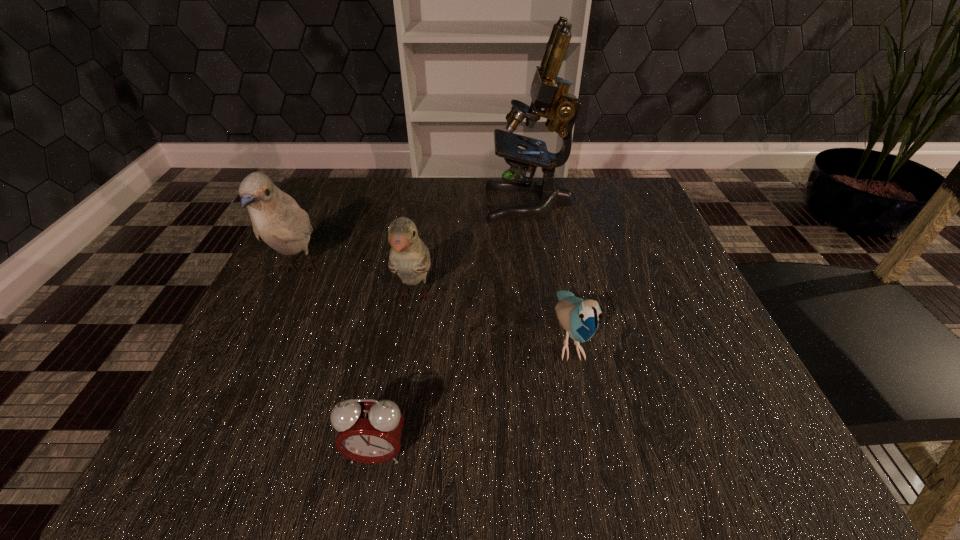
Locate an element on the screen. The image size is (960, 540). vacant space that's between the shortest object and the third tallest object is located at coordinates (396, 376).

Identify the location of free space between the tallest bird and the nearest object. Image resolution: width=960 pixels, height=540 pixels. (338, 361).

Where is `free space between the microscope and the rightmost bird`? free space between the microscope and the rightmost bird is located at coordinates (549, 271).

Locate an element on the screen. This screenshot has width=960, height=540. empty space between the leftmost bird and the third tallest object is located at coordinates (357, 284).

The image size is (960, 540). Identify the location of object that is the closest to the leftmost bird. (409, 257).

Where is `object that stands as the closest to the shortest bird`? object that stands as the closest to the shortest bird is located at coordinates (409, 257).

Image resolution: width=960 pixels, height=540 pixels. I want to click on bird that stands as the second closest to the nearest object, so click(580, 318).

Choose which bird is the nearest neighbor to the rightmost bird. Please provide its 2D coordinates. Your answer should be formatted as a tuple, i.e. [(x, y)], where the tuple contains the x and y coordinates of a point satisfying the conditions above.

[(409, 257)]

Where is `vacant area in the image that satisfies the following two spatial constraints: 1. at the eyepieces of the microscope; 2. at the face of the second tallest bird`? Image resolution: width=960 pixels, height=540 pixels. vacant area in the image that satisfies the following two spatial constraints: 1. at the eyepieces of the microscope; 2. at the face of the second tallest bird is located at coordinates (544, 299).

Find the location of a particular element. vacant space that satisfies the following two spatial constraints: 1. at the eyepieces of the tallest object; 2. at the face of the second tallest bird is located at coordinates (544, 299).